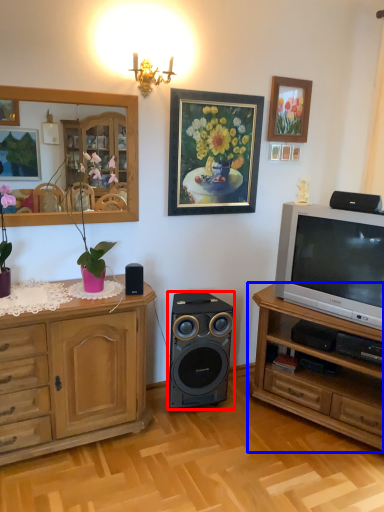
Question: Among these objects, which one is farthest to the camera, loudspeaker (highlighted by a red box) or chest of drawers (highlighted by a blue box)?

Choices:
 (A) loudspeaker
 (B) chest of drawers

Answer: (A)